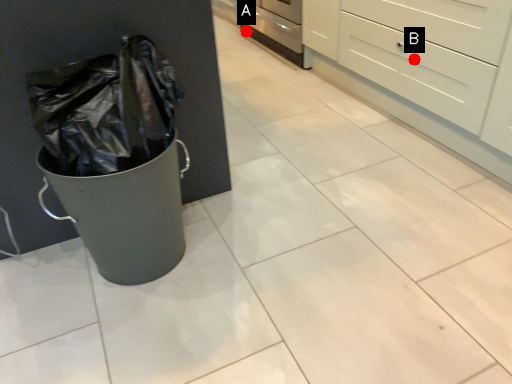
Question: Two points are circled on the image, labeled by A and B beside each circle. Which point is farther from the camera taking this photo?

Choices:
 (A) A is further
 (B) B is further

Answer: (A)